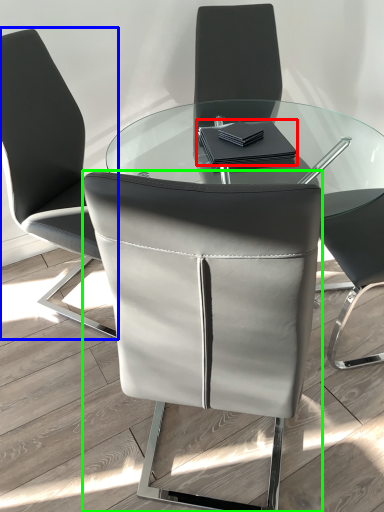
Question: Which is nearer to the notebook (highlighted by a red box)? chair (highlighted by a blue box) or chair (highlighted by a green box).

Choices:
 (A) chair
 (B) chair

Answer: (A)